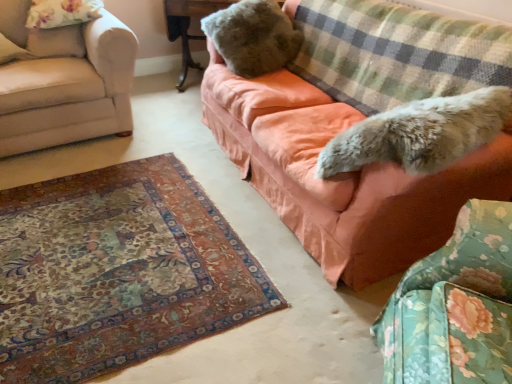
Question: From a real-world perspective, does wooden table at upper center sit lower than checkered fabric blanket at upper right?

Choices:
 (A) no
 (B) yes

Answer: (B)

Question: Considering the relative sizes of wooden table at upper center and checkered fabric blanket at upper right in the image provided, is wooden table at upper center shorter than checkered fabric blanket at upper right?

Choices:
 (A) no
 (B) yes

Answer: (A)

Question: Can you confirm if wooden table at upper center is taller than checkered fabric blanket at upper right?

Choices:
 (A) yes
 (B) no

Answer: (A)

Question: From the image's perspective, does wooden table at upper center appear lower than checkered fabric blanket at upper right?

Choices:
 (A) yes
 (B) no

Answer: (B)

Question: Can you confirm if wooden table at upper center is bigger than checkered fabric blanket at upper right?

Choices:
 (A) no
 (B) yes

Answer: (B)

Question: From a real-world perspective, is wooden table at upper center positioned above or below fluffy fabric swivel chair at lower right?

Choices:
 (A) above
 (B) below

Answer: (B)

Question: In terms of height, does wooden table at upper center look taller or shorter compared to fluffy fabric swivel chair at lower right?

Choices:
 (A) tall
 (B) short

Answer: (B)

Question: In the image, is wooden table at upper center positioned in front of or behind fluffy fabric swivel chair at lower right?

Choices:
 (A) front
 (B) behind

Answer: (B)

Question: Considering the positions of point (173, 29) and point (459, 213), is point (173, 29) closer or farther from the camera than point (459, 213)?

Choices:
 (A) closer
 (B) farther

Answer: (B)

Question: Is point (328, 8) closer or farther from the camera than point (177, 6)?

Choices:
 (A) farther
 (B) closer

Answer: (B)

Question: Is checkered fabric blanket at upper right wider or thinner than wooden table at upper center?

Choices:
 (A) thin
 (B) wide

Answer: (A)

Question: From a real-world perspective, relative to wooden table at upper center, is checkered fabric blanket at upper right vertically above or below?

Choices:
 (A) above
 (B) below

Answer: (A)

Question: Is checkered fabric blanket at upper right taller or shorter than wooden table at upper center?

Choices:
 (A) short
 (B) tall

Answer: (A)

Question: Considering the positions of point (442, 77) and point (51, 112), is point (442, 77) closer or farther from the camera than point (51, 112)?

Choices:
 (A) closer
 (B) farther

Answer: (A)

Question: From a real-world perspective, relative to beige fabric couch at left, which appears as the 1th studio couch when viewed from the left, is checkered fabric blanket at upper right vertically above or below?

Choices:
 (A) above
 (B) below

Answer: (A)